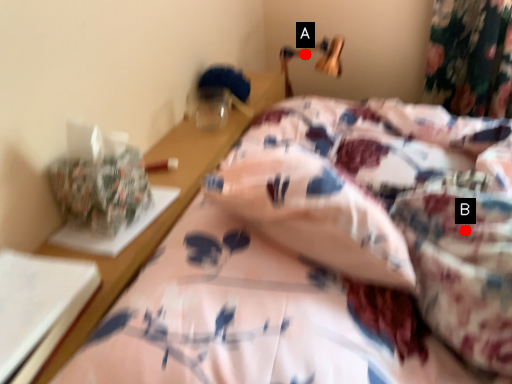
Question: Two points are circled on the image, labeled by A and B beside each circle. Which of the following is the farthest from the observer?

Choices:
 (A) A is further
 (B) B is further

Answer: (A)